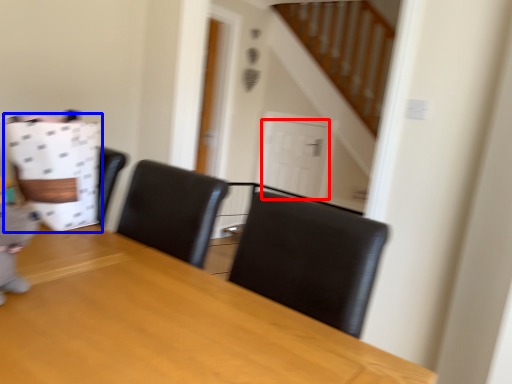
Question: Which object is further to the camera taking this photo, door (highlighted by a red box) or paper bag (highlighted by a blue box)?

Choices:
 (A) door
 (B) paper bag

Answer: (A)